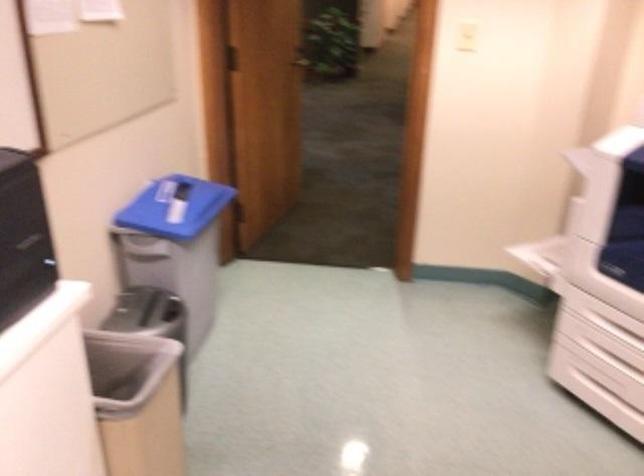
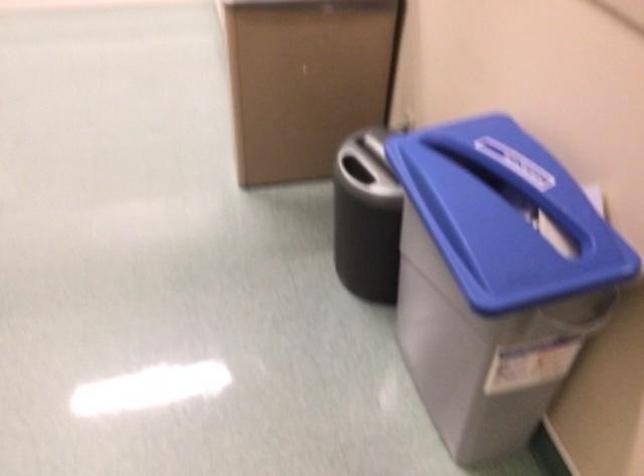
Where in the second image is the point corresponding to the point at 187,185 from the first image?

(504, 214)